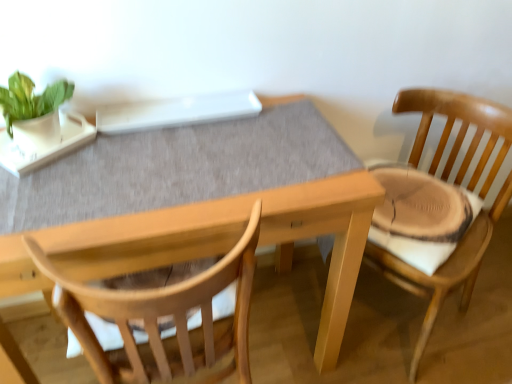
Question: From a real-world perspective, does green matte plant at upper left stand above wooden table at center?

Choices:
 (A) no
 (B) yes

Answer: (B)

Question: Would you say green matte plant at upper left contains wooden table at center?

Choices:
 (A) yes
 (B) no

Answer: (B)

Question: Considering the relative positions of green matte plant at upper left and wooden table at center in the image provided, is green matte plant at upper left behind wooden table at center?

Choices:
 (A) yes
 (B) no

Answer: (A)

Question: Would you say green matte plant at upper left is outside wooden table at center?

Choices:
 (A) no
 (B) yes

Answer: (B)

Question: Considering the relative positions of green matte plant at upper left and wooden table at center in the image provided, is green matte plant at upper left to the right of wooden table at center from the viewer's perspective?

Choices:
 (A) no
 (B) yes

Answer: (A)

Question: Is there a large distance between green matte plant at upper left and wooden table at center?

Choices:
 (A) no
 (B) yes

Answer: (A)

Question: Can you confirm if green matte plant at upper left is bigger than wooden chair at right?

Choices:
 (A) yes
 (B) no

Answer: (B)

Question: Considering the relative positions of green matte plant at upper left and wooden chair at right in the image provided, is green matte plant at upper left behind wooden chair at right?

Choices:
 (A) yes
 (B) no

Answer: (A)

Question: Is wooden chair at right at the back of green matte plant at upper left?

Choices:
 (A) no
 (B) yes

Answer: (A)

Question: Considering the relative positions of green matte plant at upper left and wooden chair at right in the image provided, is green matte plant at upper left in front of wooden chair at right?

Choices:
 (A) no
 (B) yes

Answer: (A)

Question: Can you confirm if green matte plant at upper left is thinner than wooden chair at right?

Choices:
 (A) no
 (B) yes

Answer: (B)

Question: From the image's perspective, would you say green matte plant at upper left is shown under wooden chair at right?

Choices:
 (A) yes
 (B) no

Answer: (B)

Question: Is wooden table at center not close to wooden chair at right?

Choices:
 (A) no
 (B) yes

Answer: (A)